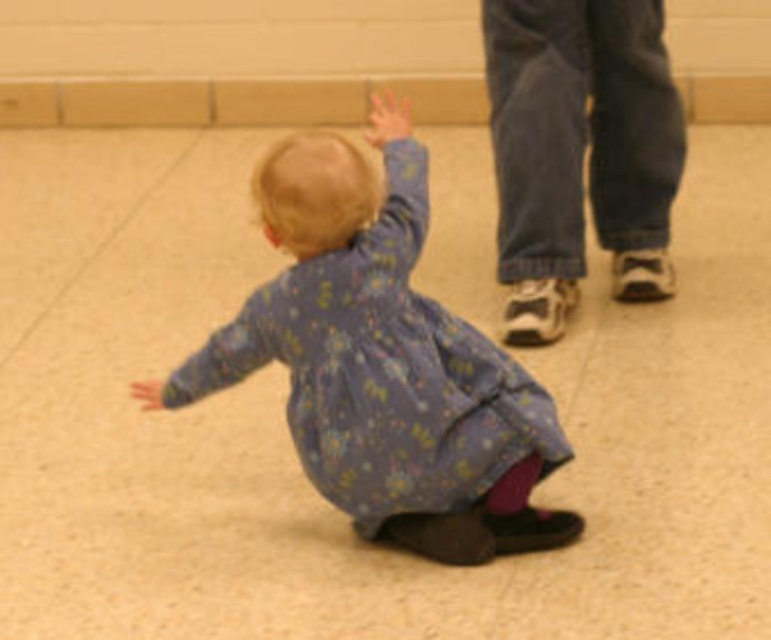
Is point (618, 48) positioned in front of point (396, 128)?

No.

Consider the image. Which of these two, denim pants at right or smooth skin hand at center, stands taller?

With more height is denim pants at right.

Is point (657, 138) closer to viewer compared to point (396, 125)?

That is False.

This screenshot has height=640, width=771. What are the coordinates of `denim pants at right` in the screenshot? It's located at (578, 150).

Which is behind, point (382, 112) or point (143, 390)?

The point (382, 112) is more distant.

Measure the distance between smooth skin hand at center and matte skin hand at lower left.

smooth skin hand at center is 36.30 inches from matte skin hand at lower left.

Measure the distance between point (406,124) and camera.

Point (406,124) is 9.49 feet away from camera.

You are a GUI agent. You are given a task and a screenshot of the screen. Output one action in this format:
    pyautogui.click(x=<x>, y=<y>)
    Task: Click on the smooth skin hand at center
    The image size is (771, 640).
    Given the screenshot: What is the action you would take?
    386,118

Looking at this image, does floral-patterned dress at center appear under matte skin hand at lower left?

No, floral-patterned dress at center is not below matte skin hand at lower left.

Can you confirm if floral-patterned dress at center is positioned to the right of matte skin hand at lower left?

Correct, you'll find floral-patterned dress at center to the right of matte skin hand at lower left.

Does point (295, 236) come in front of point (128, 388)?

Yes, it is.

In order to click on floral-patterned dress at center in this screenshot , I will do `click(386, 365)`.